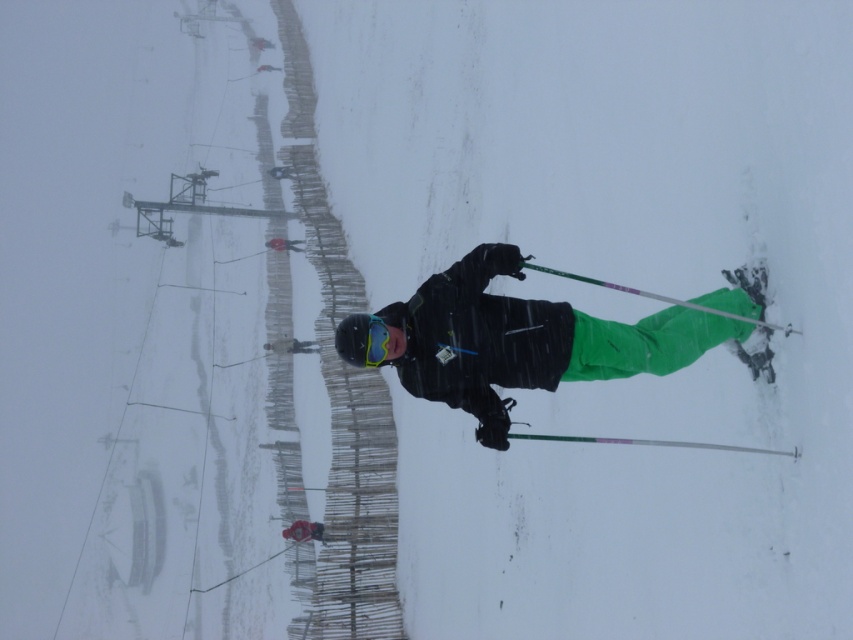
Question: Which of the following is the farthest from the observer?

Choices:
 (A) matte black helmet at center
 (B) matte blue goggles at center
 (C) matte black snowboarder at center

Answer: (A)

Question: Can you confirm if matte black snowboarder at center is positioned to the right of matte blue goggles at center?

Choices:
 (A) no
 (B) yes

Answer: (B)

Question: Among these objects, which one is farthest from the camera?

Choices:
 (A) matte blue goggles at center
 (B) matte black snowboarder at center

Answer: (A)

Question: Considering the relative positions of matte blue goggles at center and matte black helmet at center in the image provided, where is matte blue goggles at center located with respect to matte black helmet at center?

Choices:
 (A) left
 (B) right

Answer: (B)

Question: Can you confirm if matte blue goggles at center is wider than matte black helmet at center?

Choices:
 (A) no
 (B) yes

Answer: (A)

Question: Which object is farther from the camera taking this photo?

Choices:
 (A) matte black snowboarder at center
 (B) matte black helmet at center

Answer: (B)